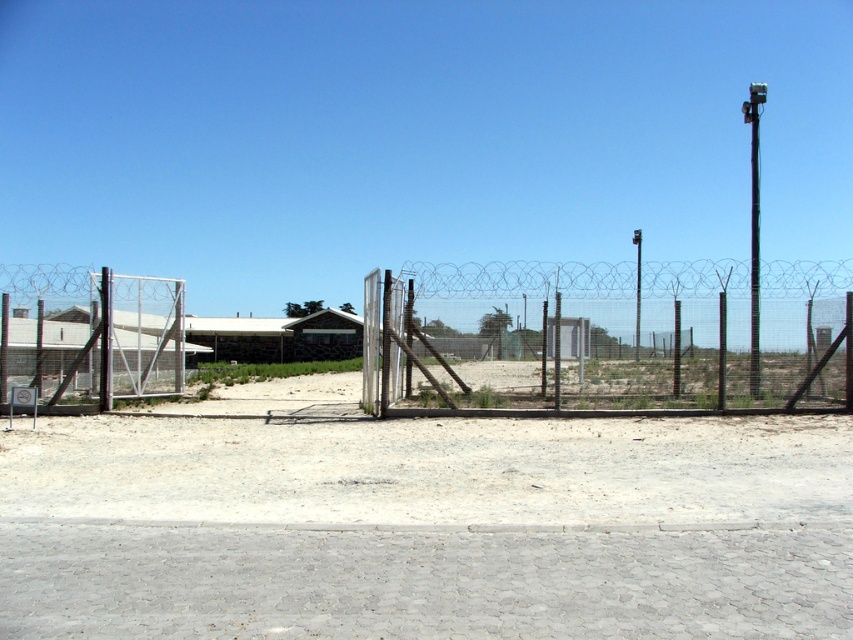
Who is lower down, white sandy dirt at center or black wire mesh fence at center?

white sandy dirt at center

Is point (572, 522) farther from camera compared to point (798, 371)?

No, (572, 522) is in front of (798, 371).

Between point (610, 424) and point (556, 333), which one is positioned in front?

Point (610, 424)

Locate an element on the screen. white sandy dirt at center is located at coordinates (430, 468).

Between black wire mesh fence at center and metallic wire mesh fence at left, which one is positioned higher?

Positioned higher is black wire mesh fence at center.

In the scene shown: Does black wire mesh fence at center have a greater width compared to metallic wire mesh fence at left?

Correct, the width of black wire mesh fence at center exceeds that of metallic wire mesh fence at left.

Who is more forward, [363,381] or [76,289]?

Point [76,289]

The height and width of the screenshot is (640, 853). Find the location of `black wire mesh fence at center`. black wire mesh fence at center is located at coordinates (610, 337).

Describe the element at coordinates (430, 468) in the screenshot. I see `white sandy dirt at center` at that location.

Who is higher up, white sandy dirt at center or metallic wire mesh fence at left?

Positioned higher is metallic wire mesh fence at left.

Which is behind, point (682, 424) or point (9, 353)?

Point (9, 353)

The height and width of the screenshot is (640, 853). Identify the location of white sandy dirt at center. (430, 468).